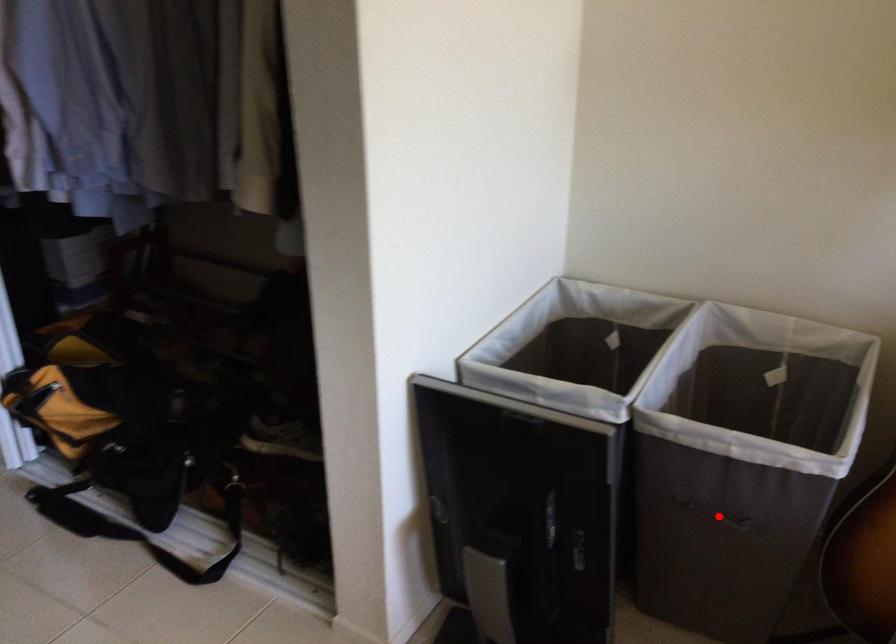
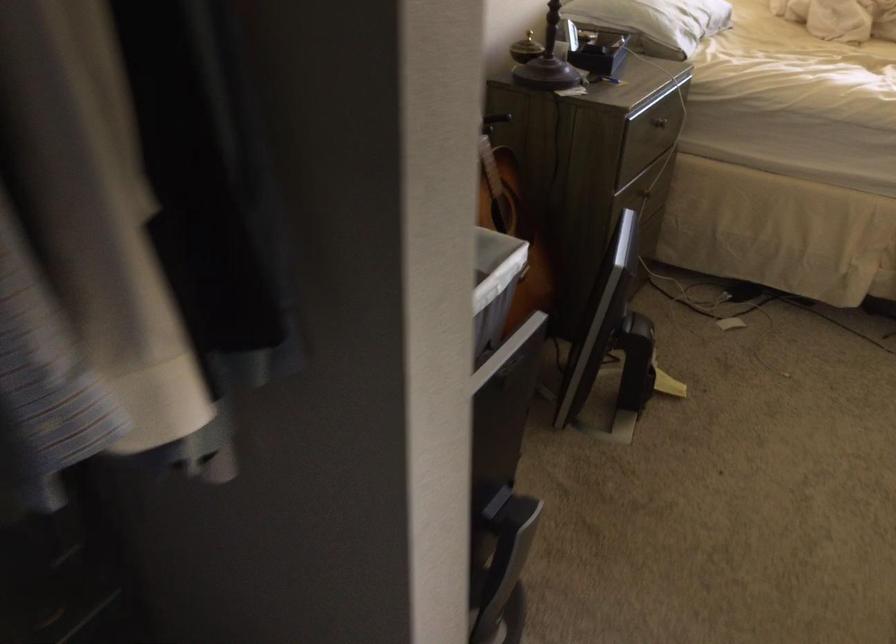
Question: I am providing you with two images of the same scene from different viewpoints. A red point is marked on the first image. Is the red point's position out of view in image 2?

Choices:
 (A) Yes
 (B) No

Answer: (A)